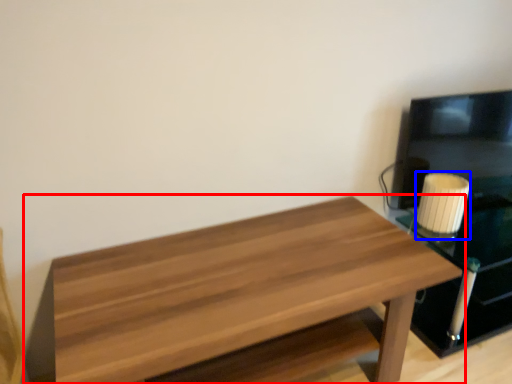
Question: Which point is closer to the camera, table (highlighted by a red box) or candle holder (highlighted by a blue box)?

Choices:
 (A) table
 (B) candle holder

Answer: (A)